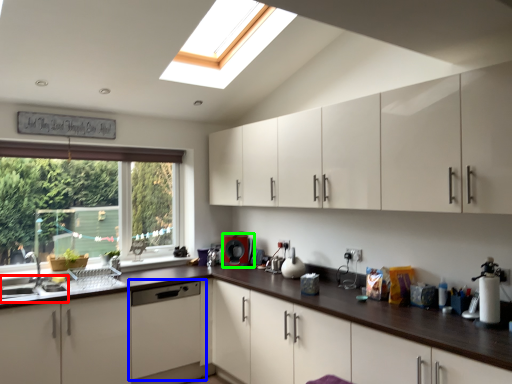
Question: Which object is positioned closest to sink (highlighted by a red box)? Select from home appliance (highlighted by a blue box) and coffee machine (highlighted by a green box).

Choices:
 (A) home appliance
 (B) coffee machine

Answer: (A)